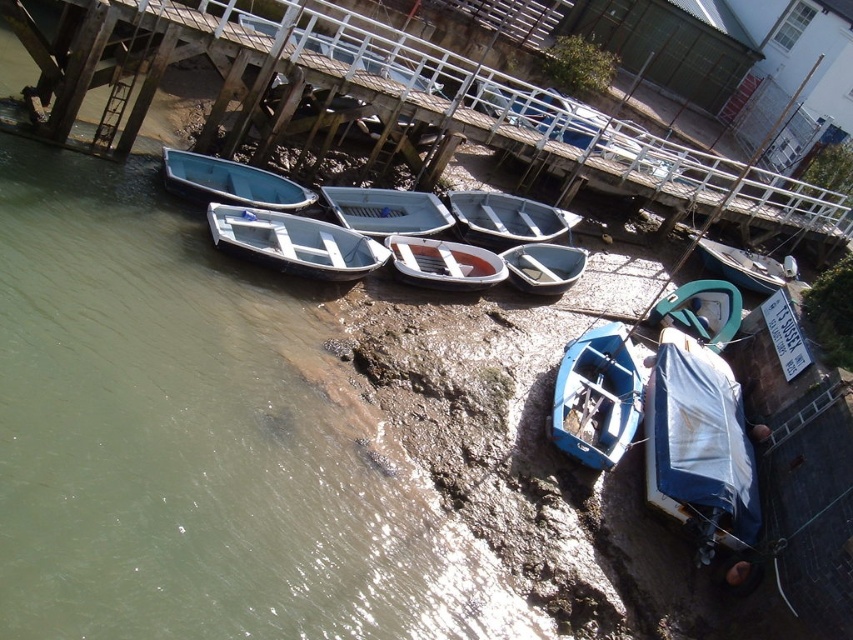
Does white tarpaulin boat at lower right appear on the left side of blue matte boat at lower right?

In fact, white tarpaulin boat at lower right is to the right of blue matte boat at lower right.

Who is more forward, (698, 444) or (592, 467)?

Point (592, 467)

Find the location of a particular element. This screenshot has width=853, height=640. white tarpaulin boat at lower right is located at coordinates (699, 445).

Is greenish water at lower left below smooth white rowboat at upper left?

Yes.

Does greenish water at lower left appear over smooth white rowboat at upper left?

Incorrect, greenish water at lower left is not positioned above smooth white rowboat at upper left.

Which is in front, point (331, 508) or point (200, 154)?

Positioned in front is point (331, 508).

What are the coordinates of `greenish water at lower left` in the screenshot? It's located at (196, 442).

Between blue matte boat at lower right and teal matte boat at center-right, which one has less height?

teal matte boat at center-right

Between blue matte boat at lower right and teal matte boat at center-right, which one appears on the right side from the viewer's perspective?

teal matte boat at center-right

Describe the element at coordinates (596, 397) in the screenshot. This screenshot has width=853, height=640. I see `blue matte boat at lower right` at that location.

This screenshot has height=640, width=853. I want to click on blue matte boat at lower right, so click(596, 397).